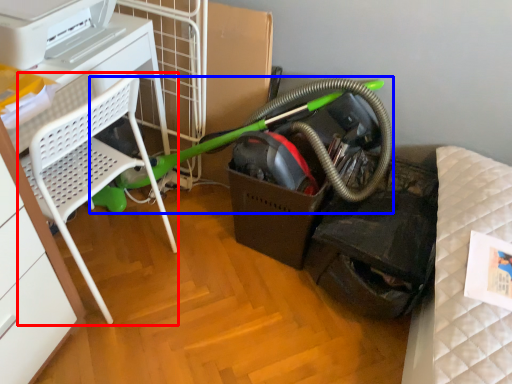
Question: Which object appears farthest to the camera in this image, furniture (highlighted by a red box) or garden hose (highlighted by a blue box)?

Choices:
 (A) furniture
 (B) garden hose

Answer: (B)